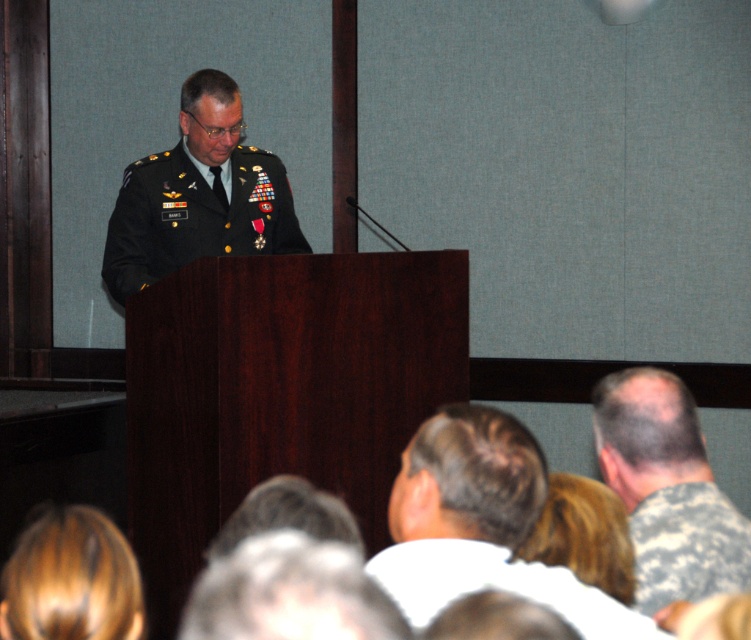
Question: Which is farther from the camouflage fabric uniform at lower center?

Choices:
 (A) camouflage uniform at lower right
 (B) blonde hair at lower left

Answer: (B)

Question: Is green military uniform at center below camouflage fabric uniform at lower right?

Choices:
 (A) yes
 (B) no

Answer: (B)

Question: Among these points, which one is nearest to the camera?

Choices:
 (A) [14, 627]
 (B) [713, 566]

Answer: (A)

Question: Which point is farther from the camera taking this photo?

Choices:
 (A) (44, 545)
 (B) (146, 230)
 (C) (427, 468)
 (D) (415, 547)

Answer: (B)

Question: Does blonde hair at lower left have a smaller size compared to camouflage fabric uniform at lower right?

Choices:
 (A) yes
 (B) no

Answer: (A)

Question: Does brown hair at lower center have a larger size compared to camouflage fabric uniform at lower right?

Choices:
 (A) yes
 (B) no

Answer: (A)